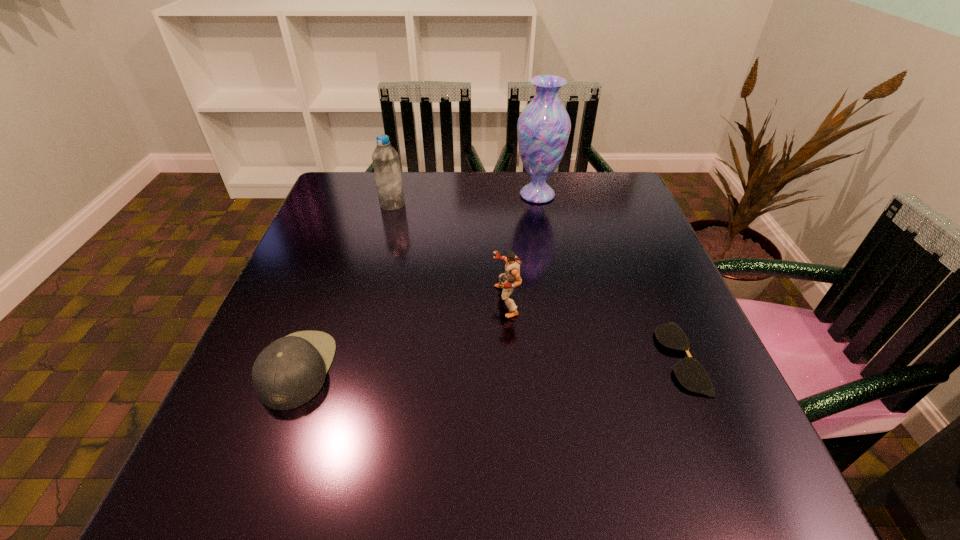
Find the location of a particular element. The image size is (960, 540). vacant region that satisfies the following two spatial constraints: 1. on the front-facing side of the rightmost object; 2. on the left side of the third shortest object is located at coordinates (509, 357).